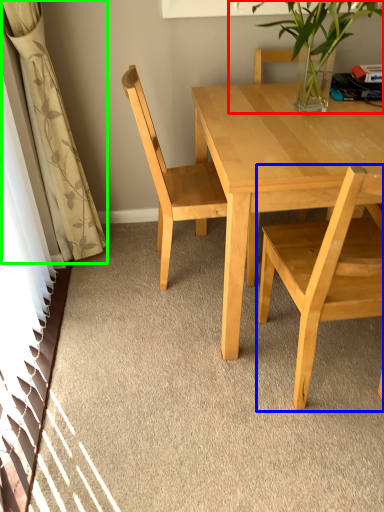
Question: Based on their relative distances, which object is farther from houseplant (highlighted by a red box)? Choose from chair (highlighted by a blue box) and curtain (highlighted by a green box).

Choices:
 (A) chair
 (B) curtain

Answer: (B)